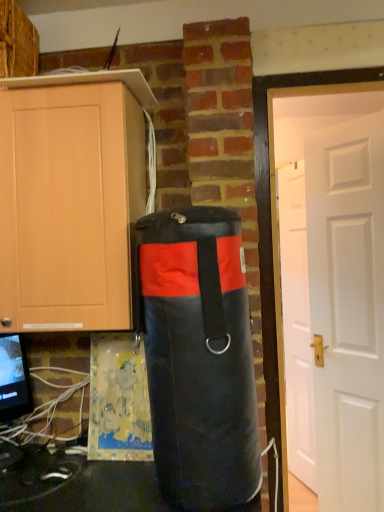
Question: Considering the positions of matte black monitor at lower left and matte wood cabinet at left in the image, is matte black monitor at lower left taller or shorter than matte wood cabinet at left?

Choices:
 (A) tall
 (B) short

Answer: (B)

Question: Considering the positions of point (11, 373) and point (102, 205), is point (11, 373) closer or farther from the camera than point (102, 205)?

Choices:
 (A) closer
 (B) farther

Answer: (B)

Question: Which of these objects is positioned farthest from the matte wood cabinet at left?

Choices:
 (A) black fabric punching bag at center
 (B) white matte door at right, the first door when ordered from back to front
 (C) matte black monitor at lower left
 (D) white matte door at right, the second door viewed from the back

Answer: (B)

Question: Which of these objects is positioned farthest from the white matte door at right, the 1th door when ordered from front to back?

Choices:
 (A) black fabric punching bag at center
 (B) matte black monitor at lower left
 (C) white matte door at right, the first door when ordered from back to front
 (D) matte wood cabinet at left

Answer: (B)